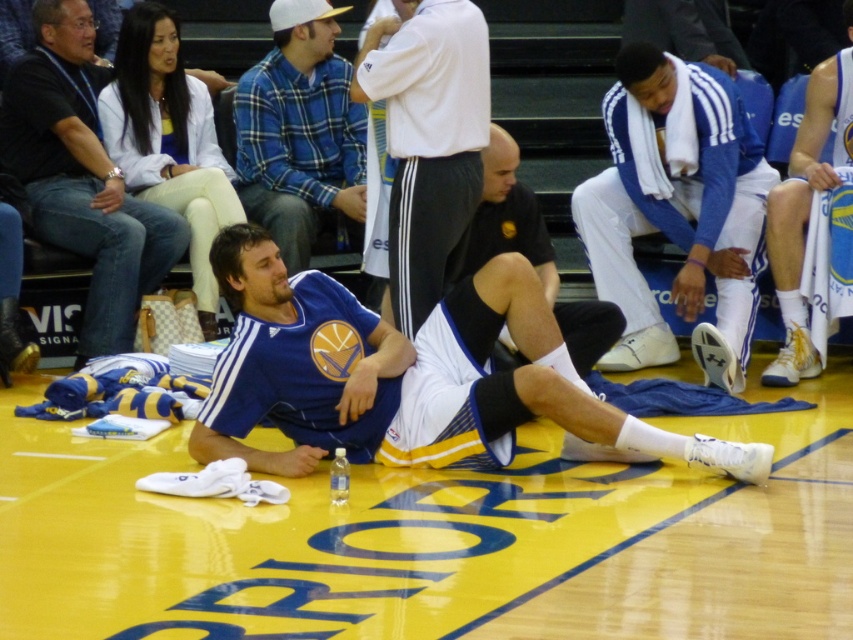
You are a photographer positioned at the center of the basketball court. You need to capture a photo that includes both the matte black jersey at upper left and the white jersey at right. Considering their sizes, which jersey should you focus on to ensure both fit in the frame without cropping?

Since the matte black jersey at upper left is wider than the white jersey at right, you should focus on the matte black jersey at upper left to ensure both fit in the frame without cropping.